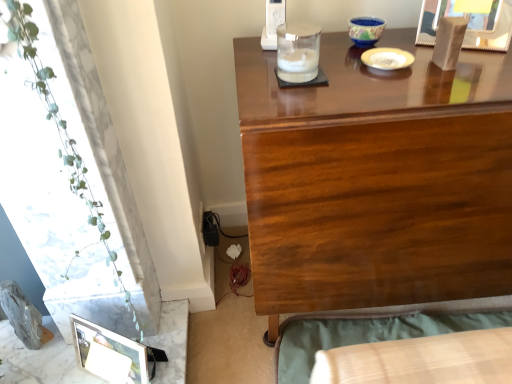
Find the location of a particular element. vacant space to the left of clear glass candle holder at upper center, arranged as the 1th candle holder when viewed from the front is located at coordinates (254, 73).